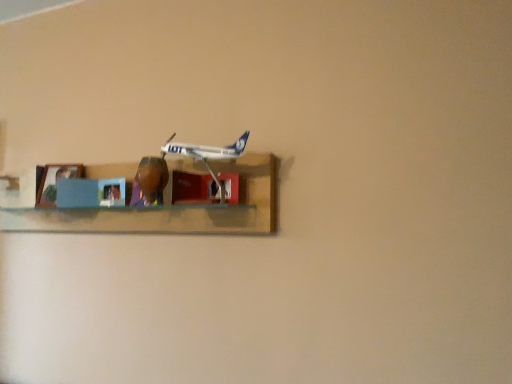
Question: From a real-world perspective, is white plastic airplane at center positioned over wooden shelf at center based on gravity?

Choices:
 (A) no
 (B) yes

Answer: (B)

Question: From the image's perspective, is white plastic airplane at center under wooden shelf at center?

Choices:
 (A) yes
 (B) no

Answer: (B)

Question: Is white plastic airplane at center wider than wooden shelf at center?

Choices:
 (A) no
 (B) yes

Answer: (A)

Question: Is white plastic airplane at center at the left side of wooden shelf at center?

Choices:
 (A) no
 (B) yes

Answer: (A)

Question: Is white plastic airplane at center thinner than wooden shelf at center?

Choices:
 (A) no
 (B) yes

Answer: (B)

Question: In terms of size, does matte blue picture frame at left appear bigger or smaller than white plastic airplane at center?

Choices:
 (A) small
 (B) big

Answer: (A)

Question: From the image's perspective, is matte blue picture frame at left located above or below white plastic airplane at center?

Choices:
 (A) above
 (B) below

Answer: (B)

Question: Is point (51, 173) positioned closer to the camera than point (181, 142)?

Choices:
 (A) closer
 (B) farther

Answer: (B)

Question: Is matte blue picture frame at left in front of or behind white plastic airplane at center in the image?

Choices:
 (A) behind
 (B) front

Answer: (A)

Question: From the image's perspective, relative to white plastic airplane at center, is wooden shelf at center above or below?

Choices:
 (A) below
 (B) above

Answer: (A)

Question: Based on their sizes in the image, would you say wooden shelf at center is bigger or smaller than white plastic airplane at center?

Choices:
 (A) big
 (B) small

Answer: (A)

Question: From their relative heights in the image, would you say wooden shelf at center is taller or shorter than white plastic airplane at center?

Choices:
 (A) tall
 (B) short

Answer: (A)

Question: Is wooden shelf at center spatially inside white plastic airplane at center, or outside of it?

Choices:
 (A) outside
 (B) inside

Answer: (A)

Question: From a real-world perspective, is white plastic airplane at center physically located above or below matte blue picture frame at left?

Choices:
 (A) above
 (B) below

Answer: (A)

Question: In terms of size, does white plastic airplane at center appear bigger or smaller than matte blue picture frame at left?

Choices:
 (A) small
 (B) big

Answer: (B)